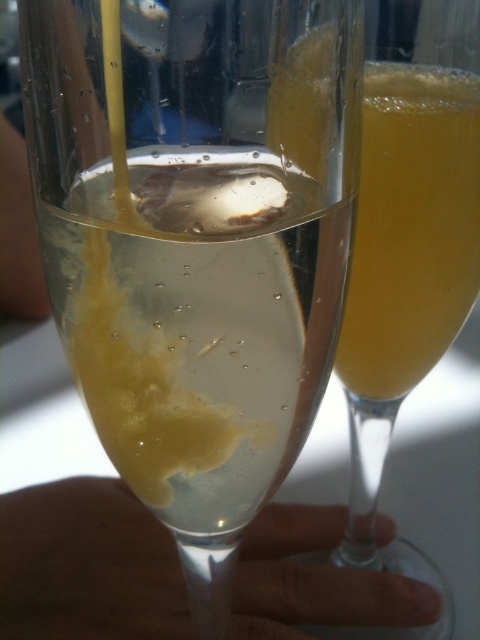
Who is taller, clear glass at center or translucent yellow liquid at center?

translucent yellow liquid at center

Can you confirm if clear glass at center is smaller than translucent yellow liquid at center?

Correct, clear glass at center occupies less space than translucent yellow liquid at center.

Which is behind, point (208, 44) or point (345, 348)?

Point (345, 348)

Where is `clear glass at center`? The height and width of the screenshot is (640, 480). clear glass at center is located at coordinates (195, 240).